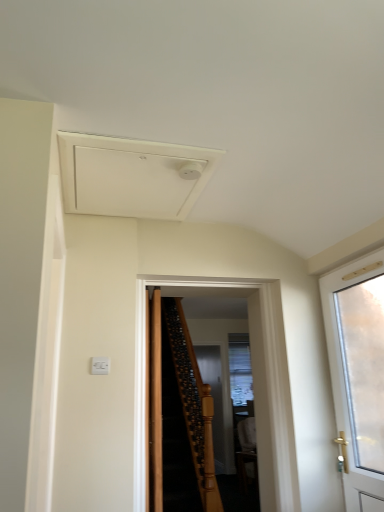
Question: Does brown wooden door at center, arranged as the third door when viewed from the right, have a lesser height compared to clear glass screen door at center?

Choices:
 (A) yes
 (B) no

Answer: (A)

Question: Considering the relative sizes of brown wooden door at center, arranged as the third door when viewed from the right, and clear glass screen door at center in the image provided, is brown wooden door at center, arranged as the third door when viewed from the right, wider than clear glass screen door at center?

Choices:
 (A) no
 (B) yes

Answer: (B)

Question: Can you confirm if brown wooden door at center, arranged as the third door when viewed from the right, is thinner than clear glass screen door at center?

Choices:
 (A) no
 (B) yes

Answer: (A)

Question: Is brown wooden door at center, the first door when ordered from left to right, at the left side of clear glass screen door at center?

Choices:
 (A) yes
 (B) no

Answer: (A)

Question: Is brown wooden door at center, the first door when ordered from left to right, smaller than clear glass screen door at center?

Choices:
 (A) yes
 (B) no

Answer: (A)

Question: Is brown wooden door at center, arranged as the third door when viewed from the right, not near clear glass screen door at center?

Choices:
 (A) yes
 (B) no

Answer: (A)

Question: Is white frosted glass door at right, which ranks as the third door in left-to-right order, facing away from brown wooden door at center, the first door when ordered from left to right?

Choices:
 (A) yes
 (B) no

Answer: (B)

Question: Does white frosted glass door at right, which appears as the 1th door when viewed from the right, appear on the right side of brown wooden door at center, arranged as the third door when viewed from the right?

Choices:
 (A) no
 (B) yes

Answer: (B)

Question: Is white frosted glass door at right, which ranks as the third door in left-to-right order, wider than brown wooden door at center, the first door when ordered from left to right?

Choices:
 (A) yes
 (B) no

Answer: (A)

Question: Is white frosted glass door at right, which ranks as the third door in left-to-right order, taller than brown wooden door at center, the first door when ordered from left to right?

Choices:
 (A) no
 (B) yes

Answer: (A)

Question: Is white frosted glass door at right, which ranks as the third door in left-to-right order, in contact with brown wooden door at center, the first door when ordered from left to right?

Choices:
 (A) no
 (B) yes

Answer: (A)

Question: Does white frosted glass door at right, which appears as the 1th door when viewed from the right, have a lesser height compared to brown wooden door at center, the first door when ordered from left to right?

Choices:
 (A) yes
 (B) no

Answer: (A)

Question: From a real-world perspective, does white matte exhaust hood at upper center stand above brown wooden door at center, which is the second door from right to left?

Choices:
 (A) no
 (B) yes

Answer: (B)